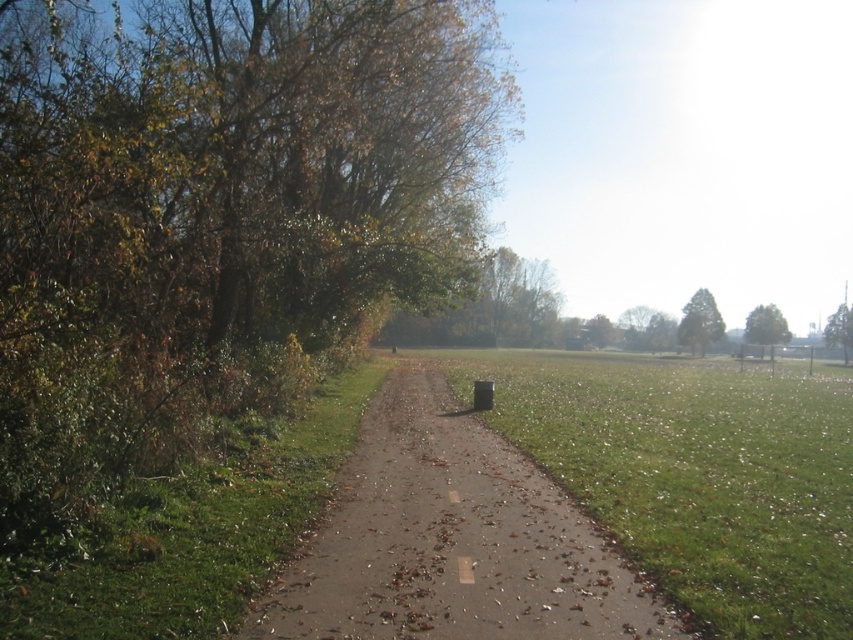
You are standing at the starting point of the pathway and want to reach a destination located at point (688,317). There is another point at (556,572) along the way. Which point should you pass first?

You should pass point (556,572) first because it is in front of point (688,317) along the pathway.

What is the 2D coordinate of the brown dirt path at center?

The 2D coordinate of the brown dirt path at center is at point (451, 541).

You are standing on the paved pathway and looking towards the upper right corner of the scene. There are two trees there. Which tree is closer to you, the green textured tree at upper right or the green leafy tree at upper right?

The green textured tree at upper right is positioned under the green leafy tree at upper right, so the green textured tree at upper right is closer to you.